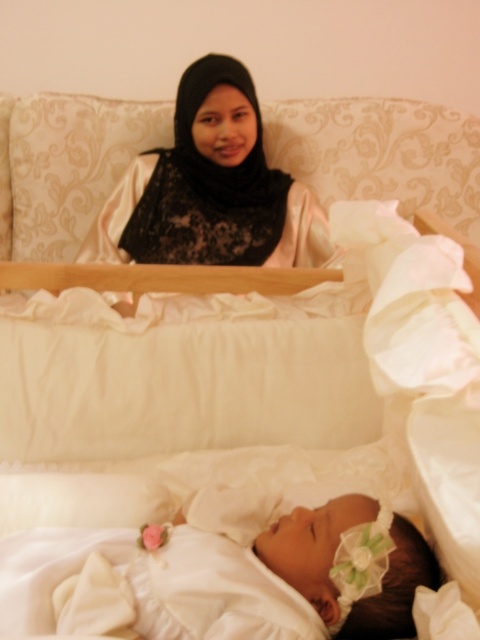
You are holding a camera and want to take a photo of the scene. The camera is currently positioned at point (90, 534). If you move the camera 10 inches closer to the scene, how far will the camera be from the original position?

The camera was originally 36.80 inches away from point (90, 534). Moving it 10 inches closer would make the new distance 26.80 inches from that point.

You are a photographer adjusting your camera to focus on the white satin dress at lower center and the matte black hijab at upper center. Which object should you focus on first if you want to capture both in sharp detail without moving the camera?

You should focus on the white satin dress at lower center first because it is closer to the viewer than the matte black hijab at upper center, allowing you to adjust the depth of field to include both objects in focus.

You are a photographer setting up for a family portrait. You notice the white satin dress at lower center and the matte black hijab at upper center in the scene. Which object takes up more visual space in the image?

The matte black hijab at upper center occupies more visual space than the white satin dress at lower center.